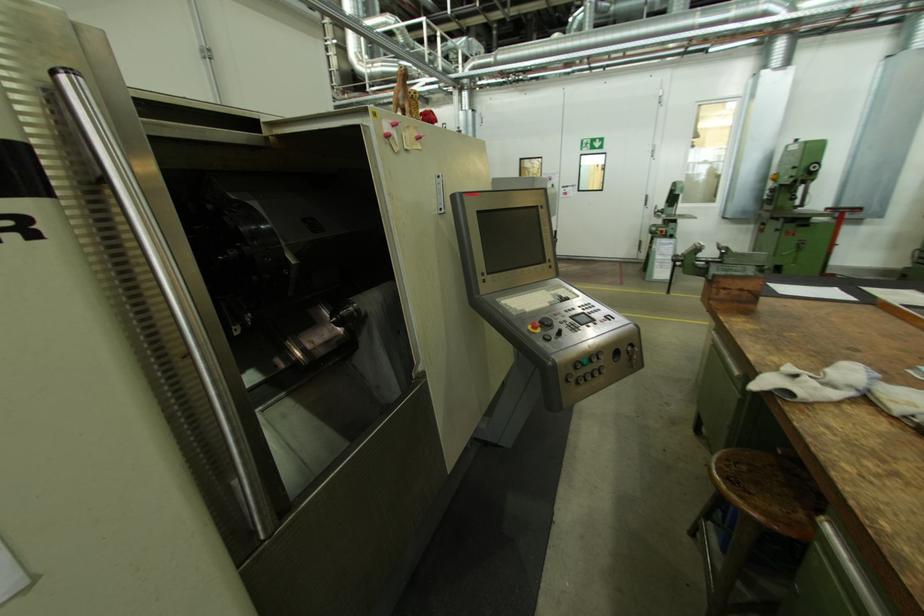
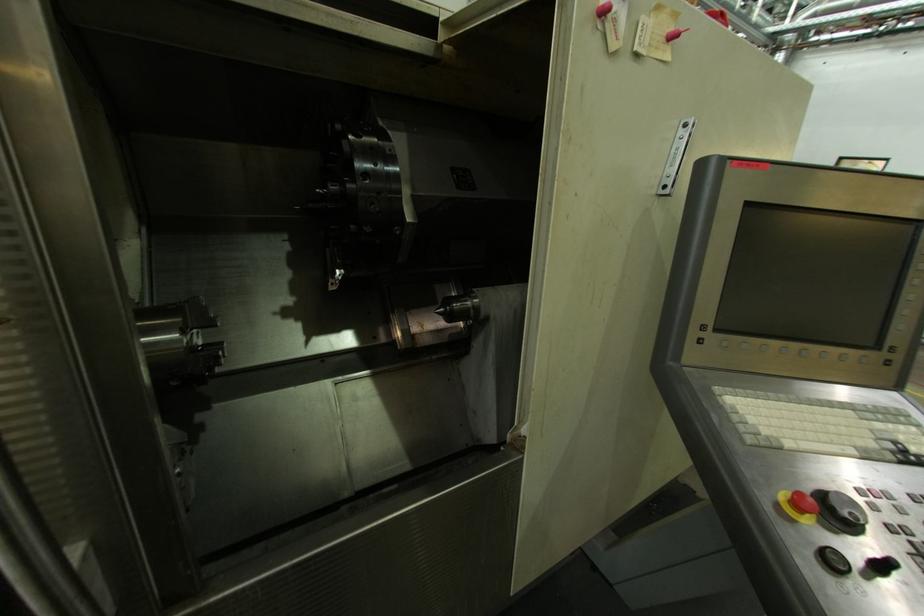
In the second image, find the point that corresponds to [535,329] in the first image.

(787, 498)